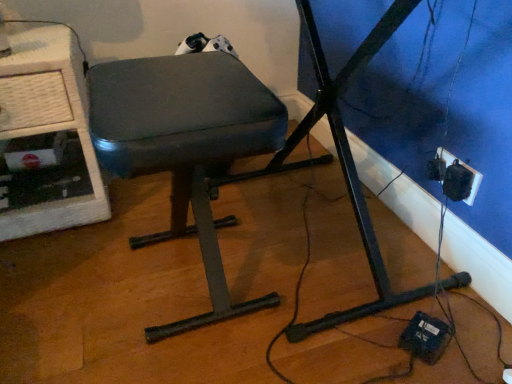
Find the location of a particular element. The width and height of the screenshot is (512, 384). vacant space underneath matte black stool at center (from a real-world perspective) is located at coordinates (178, 280).